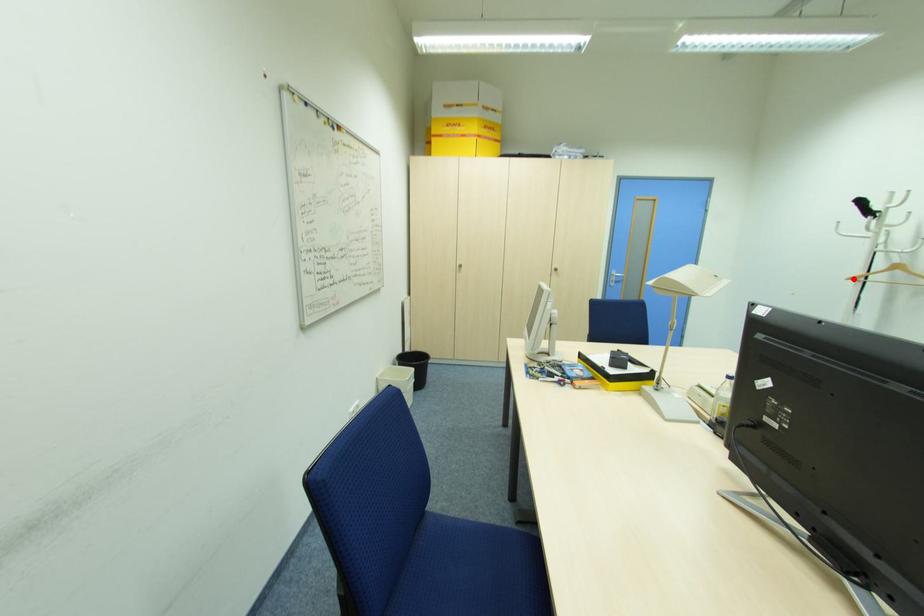
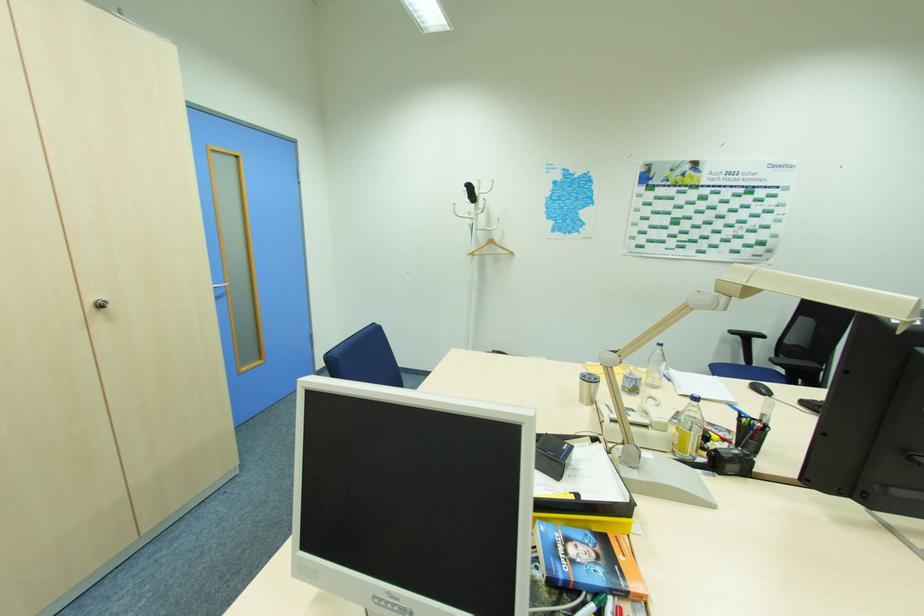
Locate, in the second image, the point that corresponds to the highlighted location in the first image.

(472, 254)